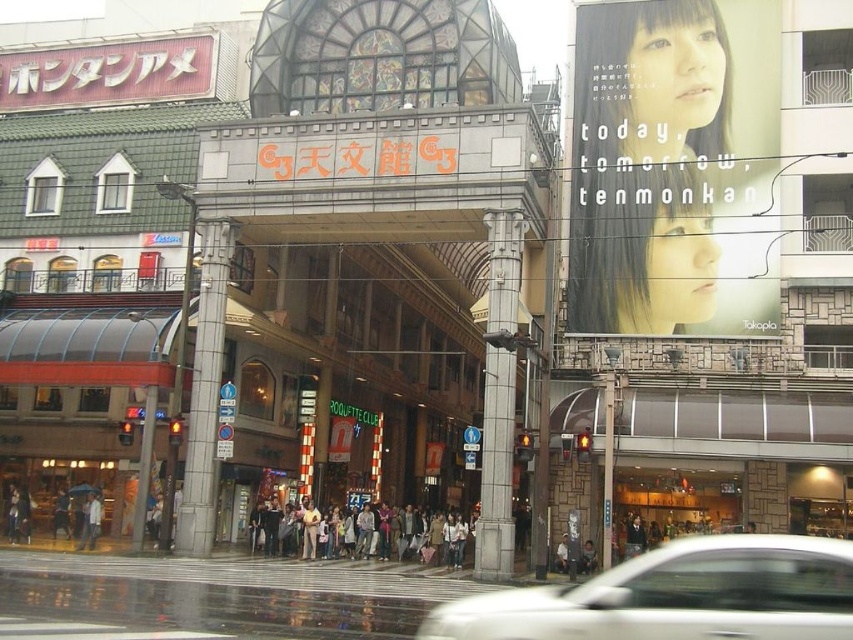
Does light gray fabric umbrella at lower left have a lesser width compared to dark brown leather jacket at center?

No.

Locate an element on the screen. The image size is (853, 640). light gray fabric umbrella at lower left is located at coordinates (91, 522).

I want to click on light gray fabric umbrella at lower left, so (x=91, y=522).

Is white glossy car at lower center in front of matte black crowd at center?

Yes, it is in front of matte black crowd at center.

Which is in front, point (601, 630) or point (447, 547)?

Positioned in front is point (601, 630).

The width and height of the screenshot is (853, 640). Identify the location of white glossy car at lower center. (676, 595).

Does white glossy car at lower center have a smaller size compared to dark brown leather jacket at center?

No, white glossy car at lower center is not smaller than dark brown leather jacket at center.

Can you confirm if white glossy car at lower center is positioned below dark brown leather jacket at center?

Incorrect, white glossy car at lower center is not positioned below dark brown leather jacket at center.

Does point (689, 570) come farther from viewer compared to point (589, 556)?

No, it is not.

The image size is (853, 640). I want to click on white glossy car at lower center, so click(676, 595).